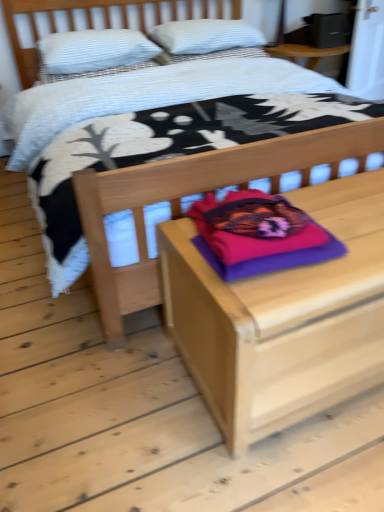
Question: Is purple soft pillow at center, the first pillow viewed from the front, bigger than white textured pillow at upper left, acting as the 2th pillow starting from the back?

Choices:
 (A) yes
 (B) no

Answer: (B)

Question: Can white textured pillow at upper left, acting as the 2th pillow starting from the back, be found inside purple soft pillow at center, which ranks as the third pillow in top-to-bottom order?

Choices:
 (A) yes
 (B) no

Answer: (B)

Question: Would you say purple soft pillow at center, which ranks as the third pillow in top-to-bottom order, is outside white textured pillow at upper left, acting as the 2th pillow starting from the back?

Choices:
 (A) yes
 (B) no

Answer: (A)

Question: Can you confirm if purple soft pillow at center, the 3th pillow in the back-to-front sequence, is wider than white textured pillow at upper left, acting as the 2th pillow starting from the back?

Choices:
 (A) yes
 (B) no

Answer: (B)

Question: Does purple soft pillow at center, which ranks as the third pillow in top-to-bottom order, have a smaller size compared to white textured pillow at upper left, the second pillow viewed from the front?

Choices:
 (A) no
 (B) yes

Answer: (B)

Question: From a real-world perspective, is purple soft pillow at center, which ranks as the third pillow in top-to-bottom order, beneath white textured pillow at upper left, the second pillow in the bottom-to-top sequence?

Choices:
 (A) yes
 (B) no

Answer: (A)

Question: Is the depth of white textured pillow at upper left, which is the second pillow from top to bottom, less than that of purple soft pillow at center, which ranks as the third pillow in top-to-bottom order?

Choices:
 (A) no
 (B) yes

Answer: (A)

Question: Is white textured pillow at upper left, which is the second pillow from top to bottom, to the left of purple soft pillow at center, the first pillow viewed from the front, from the viewer's perspective?

Choices:
 (A) no
 (B) yes

Answer: (B)

Question: From a real-world perspective, is white textured pillow at upper left, acting as the 2th pillow starting from the back, located beneath purple soft pillow at center, the first pillow viewed from the front?

Choices:
 (A) yes
 (B) no

Answer: (B)

Question: Are white textured pillow at upper left, the second pillow viewed from the front, and purple soft pillow at center, which ranks as the third pillow in top-to-bottom order, far apart?

Choices:
 (A) yes
 (B) no

Answer: (A)

Question: Would you say white textured pillow at upper left, which is the second pillow from top to bottom, is outside purple soft pillow at center, which ranks as the third pillow in top-to-bottom order?

Choices:
 (A) yes
 (B) no

Answer: (A)

Question: Is the position of white textured pillow at upper left, the second pillow viewed from the front, more distant than that of purple soft pillow at center, the first pillow viewed from the front?

Choices:
 (A) yes
 (B) no

Answer: (A)